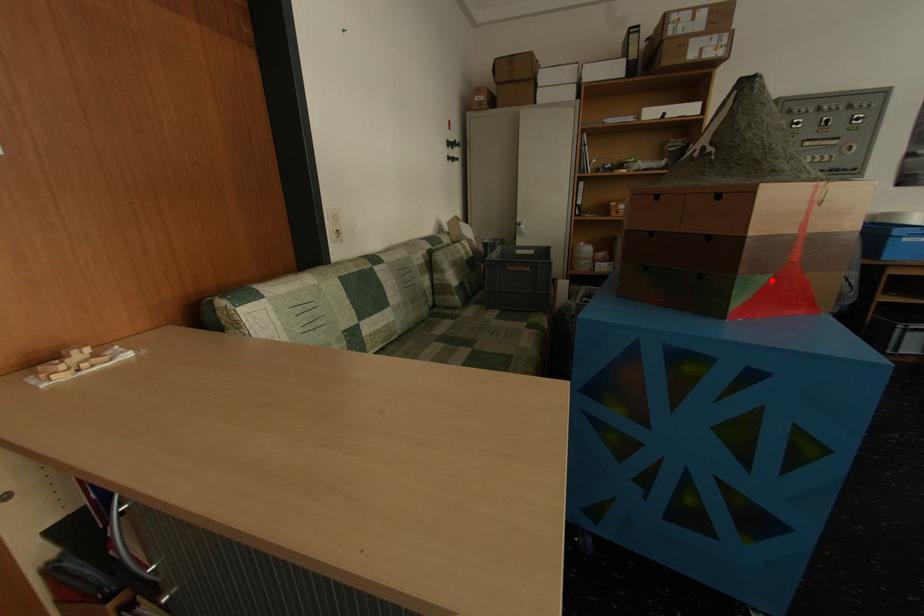
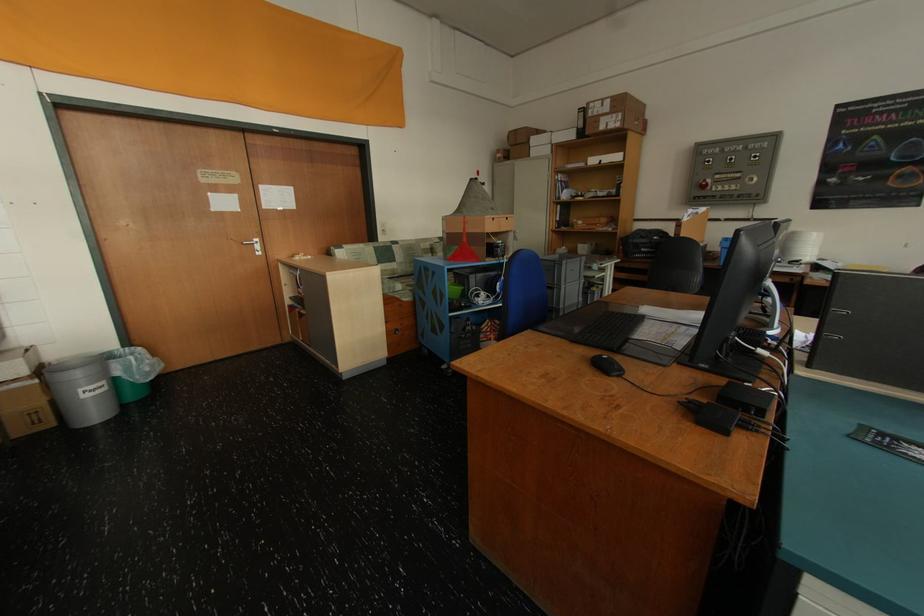
Find the pixel in the second image that matches the highlighted location in the first image.

(465, 249)